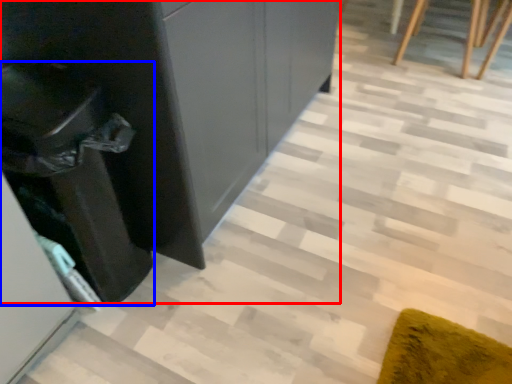
Question: Which object is closer to the camera taking this photo, dresser (highlighted by a red box) or cabinetry (highlighted by a blue box)?

Choices:
 (A) dresser
 (B) cabinetry

Answer: (B)